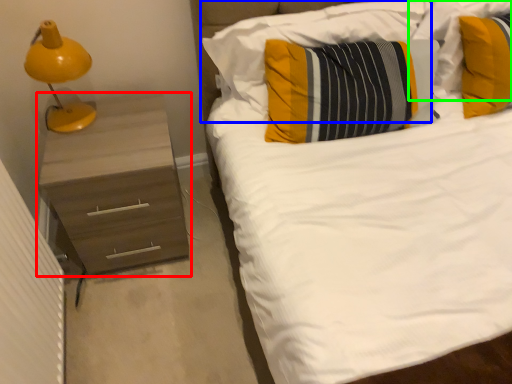
Question: Estimate the real-world distances between objects in this image. Which object is farther from chest of drawers (highlighted by a red box), pillow (highlighted by a blue box) or pillow (highlighted by a green box)?

Choices:
 (A) pillow
 (B) pillow

Answer: (B)